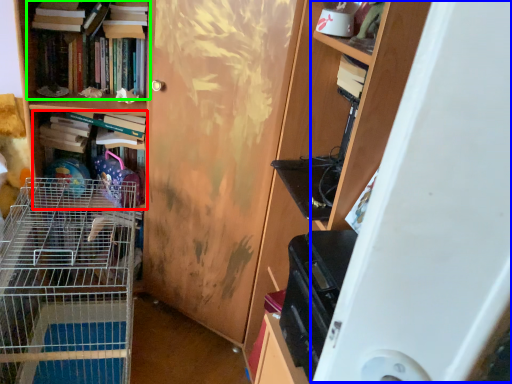
Question: Estimate the real-world distances between objects in this image. Which object is farther from book (highlighted by a red box), wide (highlighted by a blue box) or book (highlighted by a green box)?

Choices:
 (A) wide
 (B) book

Answer: (A)